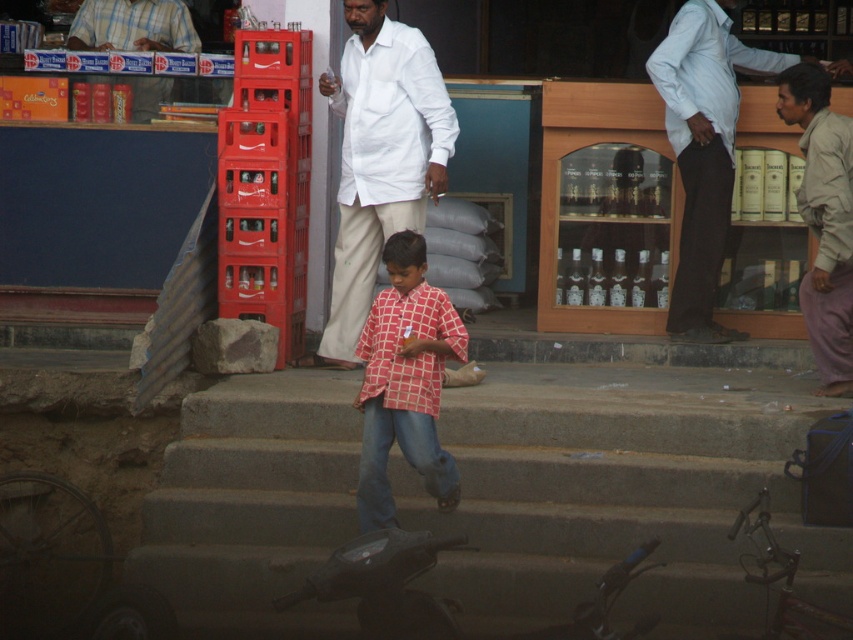
You are standing at the point marked as point (621, 493) in the image. What object is directly in front of you?

The concrete stairs at center are located at point (621, 493), so the object directly in front of you is the concrete stairs at center.

You are a customer trying to enter the shop. You see the white cotton shirt at center and the light blue shirt at upper right. Which one is closer to the entrance?

The white cotton shirt at center is closer to the entrance because it is in front of the light blue shirt at upper right.